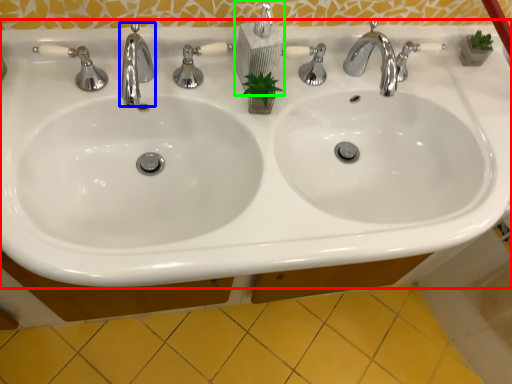
Question: Based on their relative distances, which object is farther from sink (highlighted by a red box)? Choose from tap (highlighted by a blue box) and soap dispenser (highlighted by a green box).

Choices:
 (A) tap
 (B) soap dispenser

Answer: (A)